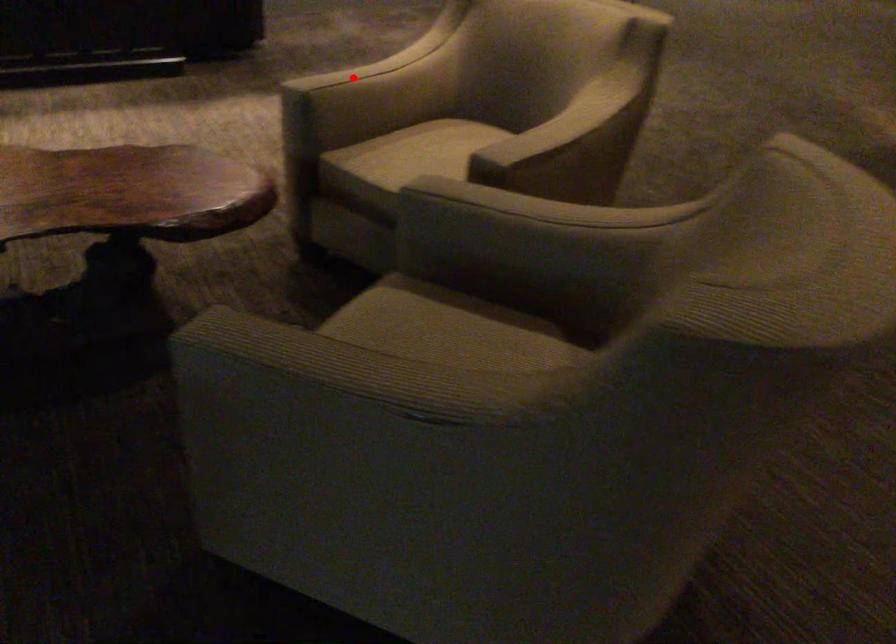
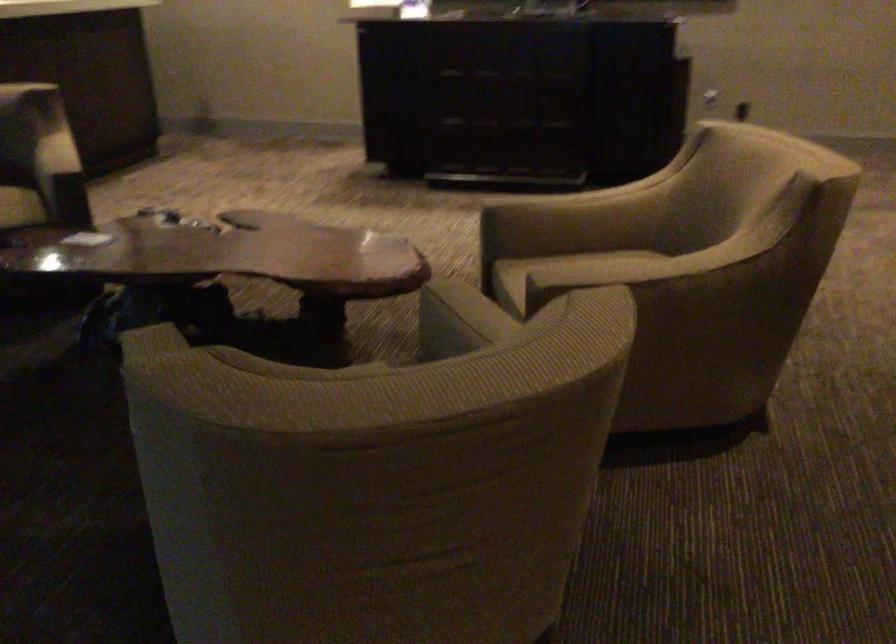
The point at the highlighted location is marked in the first image. Where is the corresponding point in the second image?

(547, 200)